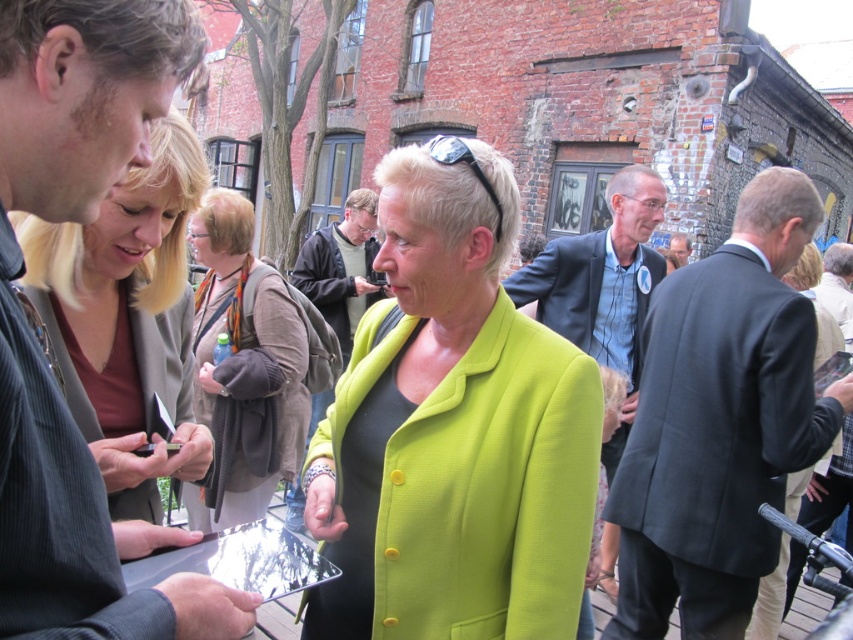
Between lime green fabric jacket at center and blue striped shirt at center, which one is positioned lower?

Positioned lower is lime green fabric jacket at center.

From the picture: How far apart are lime green fabric jacket at center and blue striped shirt at center?

They are 3.48 meters apart.

Is point (558, 385) positioned behind point (634, 211)?

No, (558, 385) is closer to viewer.

Where is `lime green fabric jacket at center`? lime green fabric jacket at center is located at coordinates (451, 429).

Which of these two, dark gray jacket at center or dark blue suit at center, stands shorter?

With less height is dark blue suit at center.

Between dark gray jacket at center and dark blue suit at center, which one is positioned higher?

dark blue suit at center

Is point (310, 244) closer to camera compared to point (682, 232)?

Yes, it is in front of point (682, 232).

Identify the location of dark gray jacket at center. The width and height of the screenshot is (853, 640). (341, 268).

Can you confirm if matte brown leather jacket at upper left is bigger than blue striped shirt at center?

Incorrect, matte brown leather jacket at upper left is not larger than blue striped shirt at center.

In the scene shown: Who is positioned more to the right, matte brown leather jacket at upper left or blue striped shirt at center?

From the viewer's perspective, blue striped shirt at center appears more on the right side.

Between point (190, 410) and point (637, 275), which one is positioned in front?

Point (190, 410)

At what (x,y) coordinates should I click in order to perform the action: click on matte brown leather jacket at upper left. Please return your answer as a coordinate pair (x, y). Image resolution: width=853 pixels, height=640 pixels. Looking at the image, I should click on (125, 298).